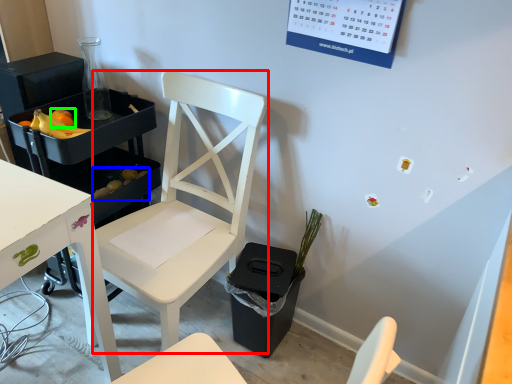
Question: Based on their relative distances, which object is nearer to chair (highlighted by a red box)? Choose from food (highlighted by a blue box) and fruit (highlighted by a green box).

Choices:
 (A) food
 (B) fruit

Answer: (A)